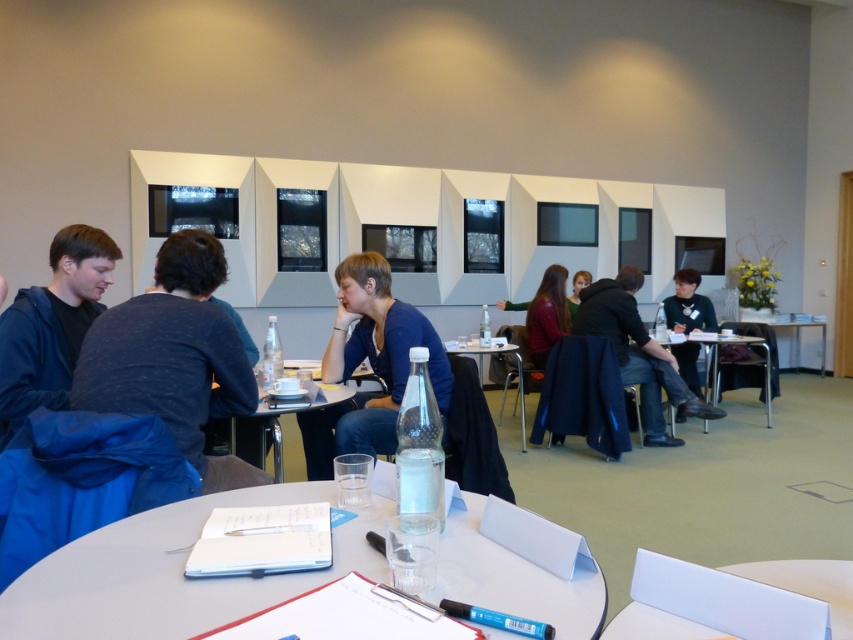
Question: Which object appears closest to the camera in this image?

Choices:
 (A) matte black dress at center
 (B) white plastic table at center
 (C) blue matte shirt at center
 (D) clear glass table at center

Answer: (B)

Question: Which point is closer to the camera taking this photo?

Choices:
 (A) (746, 316)
 (B) (653, 339)
 (C) (329, 570)
 (D) (817, 616)

Answer: (D)

Question: Is dark blue jeans at center smaller than matte black dress at center?

Choices:
 (A) yes
 (B) no

Answer: (B)

Question: Is blue fleece jacket at left above dark blue sweater at center?

Choices:
 (A) no
 (B) yes

Answer: (A)

Question: Which point is closer to the camera?

Choices:
 (A) (585, 332)
 (B) (326, 392)
 (C) (767, 321)

Answer: (B)

Question: Is white paper at center above metallic silver table at right?

Choices:
 (A) no
 (B) yes

Answer: (A)